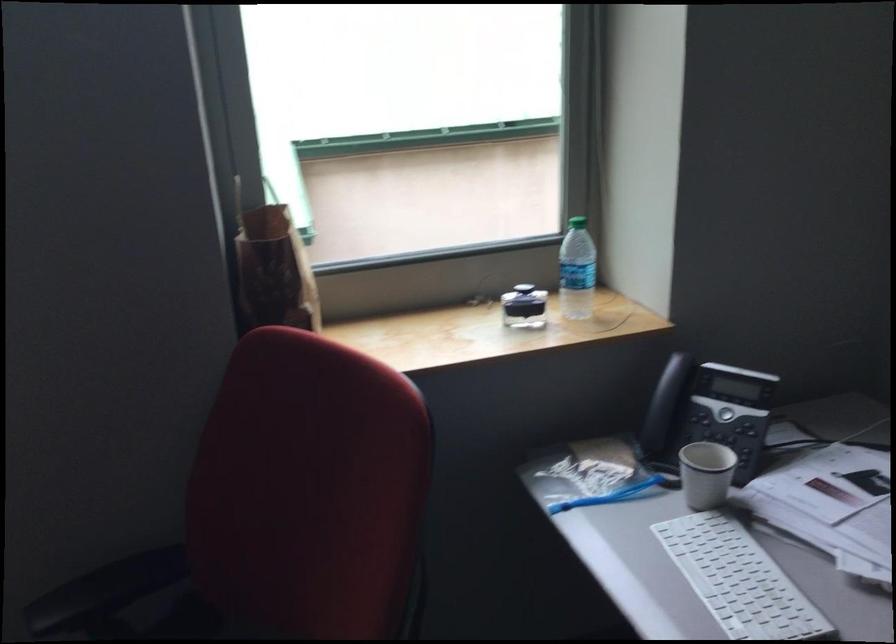
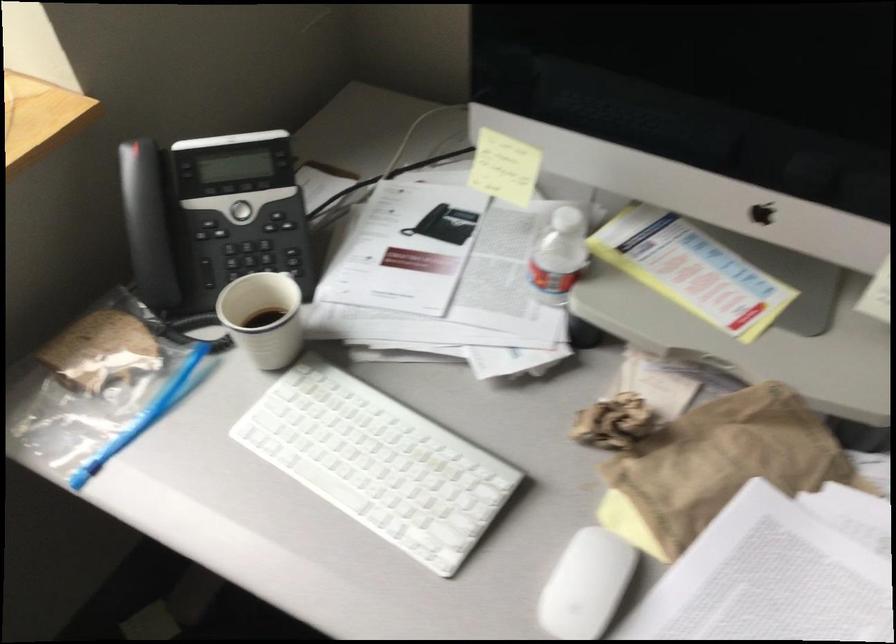
Question: I am providing you with two images of the same scene from different viewpoints. Which of the following objects are not visible in image2?

Choices:
 (A) phone navigation button
 (B) crumpled brown paper
 (C) blue bag slider
 (D) none of these

Answer: (D)